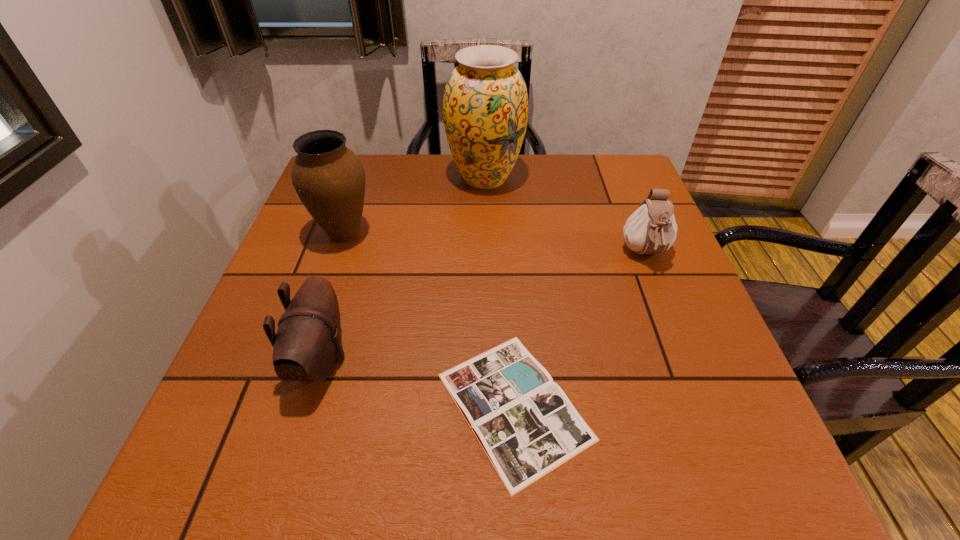
Where is `vacant space situated on the front-facing side of the rightmost object`? This screenshot has height=540, width=960. vacant space situated on the front-facing side of the rightmost object is located at coordinates (693, 376).

Locate an element on the screen. Image resolution: width=960 pixels, height=540 pixels. blank space located on the left of the shortest object is located at coordinates (217, 406).

Find the location of a particular element. The height and width of the screenshot is (540, 960). object at the far edge is located at coordinates [485, 106].

You are a GUI agent. You are given a task and a screenshot of the screen. Output one action in this format:
    pyautogui.click(x=<x>, y=<y>)
    Task: Click on the object that is positioned at the near edge
    This screenshot has height=540, width=960.
    Given the screenshot: What is the action you would take?
    pyautogui.click(x=525, y=423)

Where is `urn positioned at the left edge`? urn positioned at the left edge is located at coordinates (329, 179).

Locate an element on the screen. The image size is (960, 540). pouch located in the left edge section of the desktop is located at coordinates (307, 345).

The image size is (960, 540). What are the coordinates of `object present at the right edge` in the screenshot? It's located at (651, 229).

Image resolution: width=960 pixels, height=540 pixels. Find the location of `vacant space at the far edge of the desktop`. vacant space at the far edge of the desktop is located at coordinates (447, 154).

In order to click on free spot at the near edge of the desktop in this screenshot , I will do `click(614, 441)`.

Locate an element on the screen. vacant space at the left edge of the desktop is located at coordinates (315, 274).